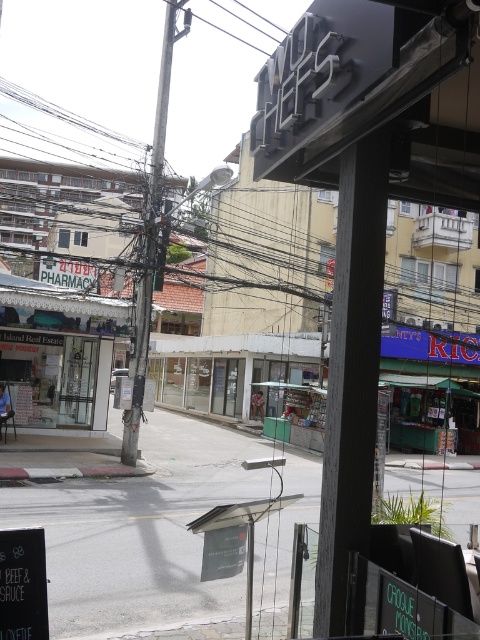
You are a delivery person trying to navigate through the street. You see the white glass storefront at left and the metallic gray pole at center. Which object is closer to you as you face the street?

The white glass storefront at left is closer to you because the metallic gray pole at center is behind it.

What is located at the point with coordinates (x=58, y=352)?

A white glass storefront at left is located at point (x=58, y=352).

In the scene shown: You are a delivery person needing to access the white glass storefront at left. There is a black matte pole at center blocking your path. Can you walk around the pole to reach the storefront?

The black matte pole at center is in front of the white glass storefront at left, so you can walk around the pole to access the storefront.